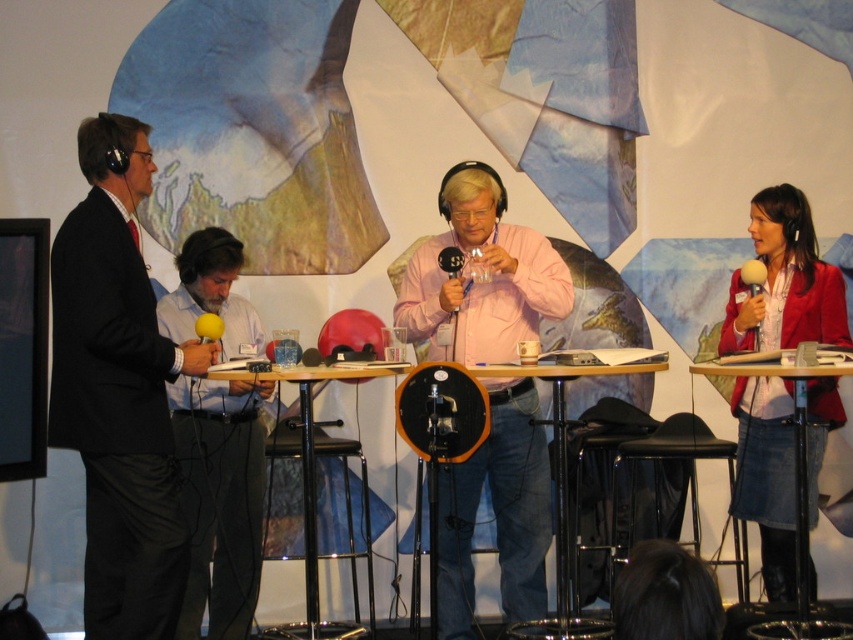
Measure the distance from denim skirt at lower right to white matte microphone at upper right.

14.16 inches

Does denim skirt at lower right lie behind white matte microphone at upper right?

No, denim skirt at lower right is closer to the viewer.

Find the location of a particular element. The image size is (853, 640). denim skirt at lower right is located at coordinates (770, 372).

Where is `denim skirt at lower right`? denim skirt at lower right is located at coordinates (770, 372).

Between point (723, 561) and point (445, 298), which one is positioned in front?

Point (445, 298)

What do you see at coordinates (677, 460) in the screenshot? This screenshot has height=640, width=853. I see `black plastic stool at lower center` at bounding box center [677, 460].

At what (x,y) coordinates should I click in order to perform the action: click on black plastic stool at lower center. Please return your answer as a coordinate pair (x, y). Looking at the image, I should click on (677, 460).

Between matte blue shirt at center and black plastic table at center, which one appears on the right side from the viewer's perspective?

From the viewer's perspective, black plastic table at center appears more on the right side.

Between matte blue shirt at center and black plastic table at center, which one has less height?

With less height is black plastic table at center.

Is point (198, 278) positioned after point (555, 385)?

Yes, point (198, 278) is farther from viewer.

Locate an element on the screen. The height and width of the screenshot is (640, 853). matte blue shirt at center is located at coordinates (219, 499).